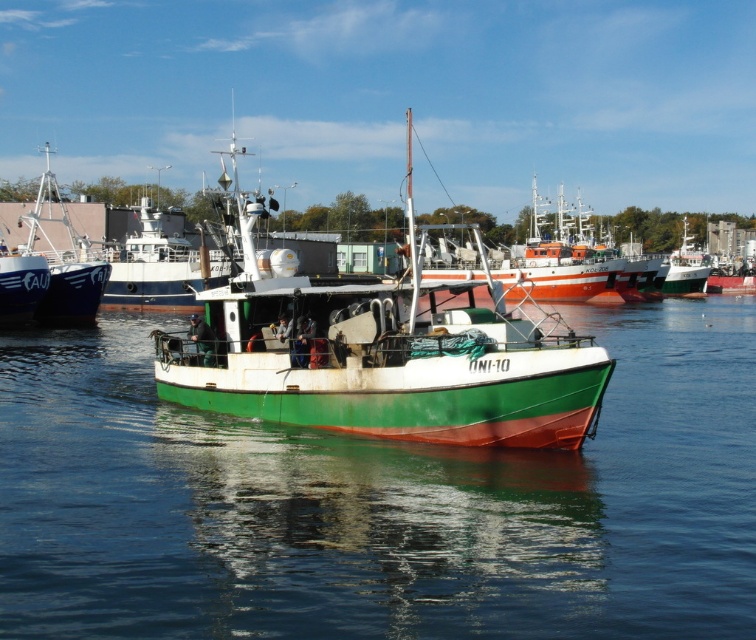
Question: Considering the real-world distances, which object is closest to the green matte boat at center?

Choices:
 (A) green painted wooden boat at center
 (B) green matte water at center
 (C) white glossy boat at upper left

Answer: (B)

Question: Which of the following is the farthest from the observer?

Choices:
 (A) (606, 273)
 (B) (11, 448)
 (C) (57, 298)
 (D) (217, 360)

Answer: (A)

Question: Does green matte boat at center lie in front of white glossy boat at upper left?

Choices:
 (A) no
 (B) yes

Answer: (B)

Question: Does green painted wooden boat at center appear under white glossy boat at upper left?

Choices:
 (A) no
 (B) yes

Answer: (B)

Question: Is the position of green painted wooden boat at center less distant than that of white glossy boat at upper left?

Choices:
 (A) yes
 (B) no

Answer: (A)

Question: Which object is closer to the camera taking this photo?

Choices:
 (A) green matte boat at center
 (B) white glossy boat at upper left
 (C) green painted wooden boat at center
 (D) green matte water at center

Answer: (D)